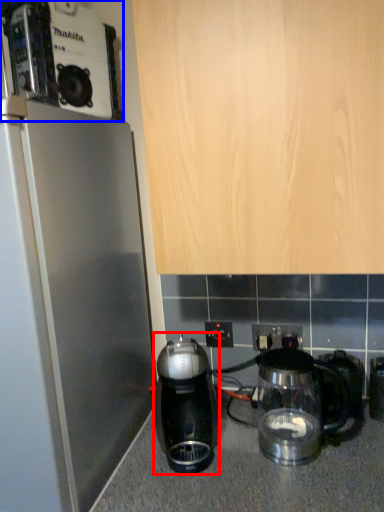
Question: Among these objects, which one is farthest to the camera, kitchen appliance (highlighted by a red box) or coffee maker (highlighted by a blue box)?

Choices:
 (A) kitchen appliance
 (B) coffee maker

Answer: (A)